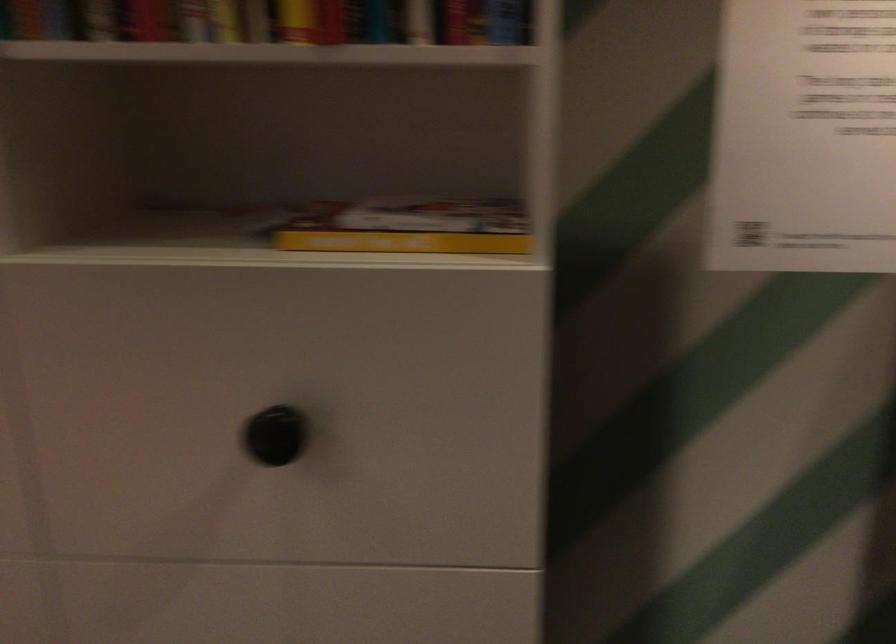
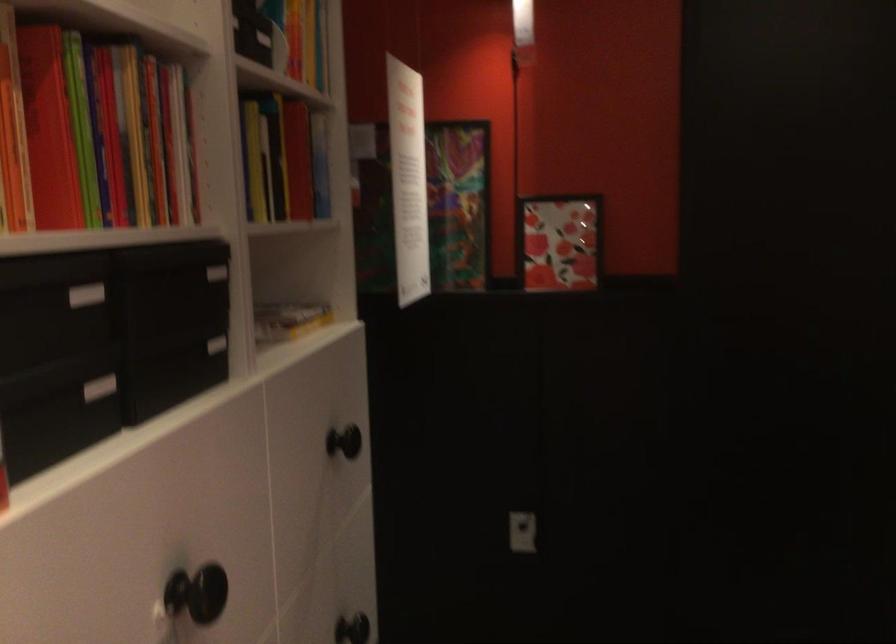
In the second image, find the point that corresponds to point (371, 213) in the first image.

(288, 319)